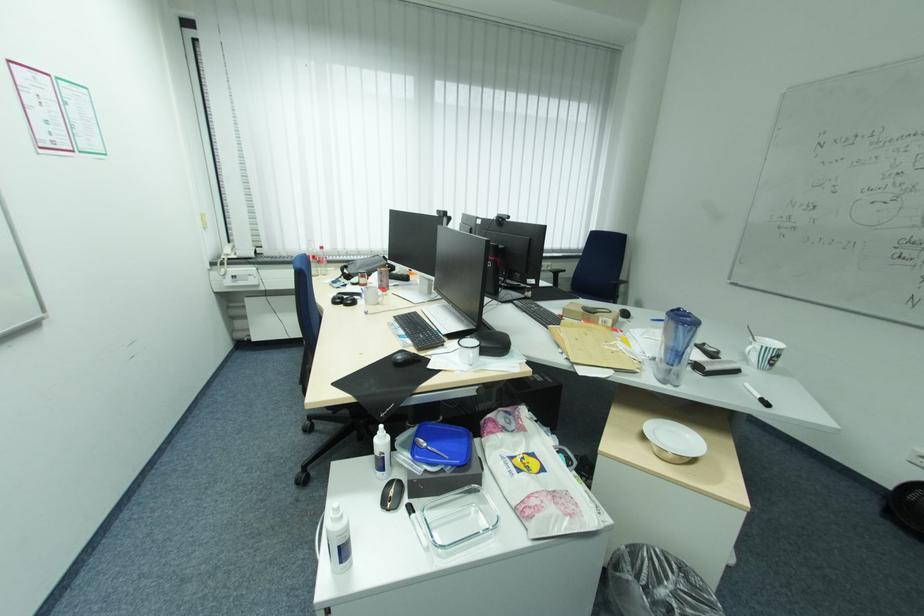
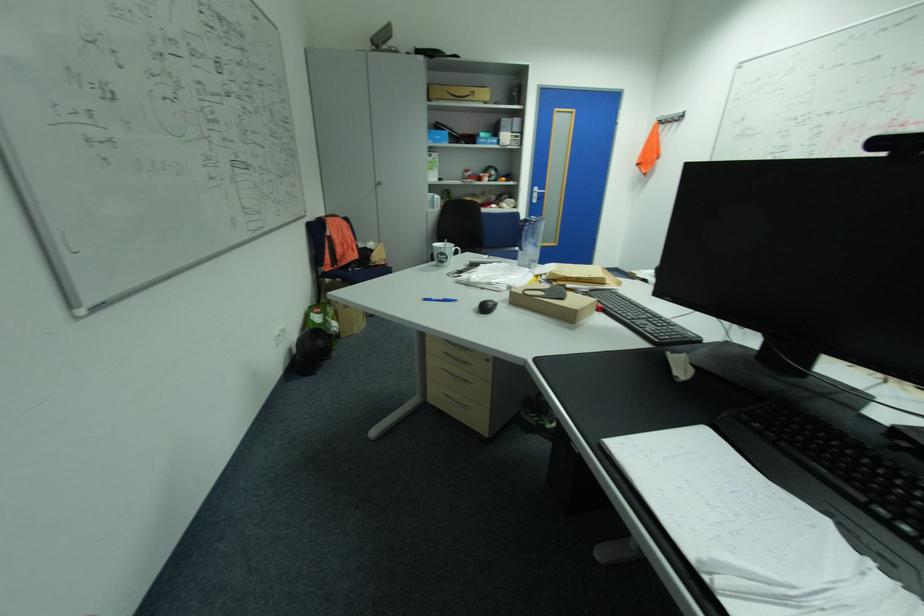
Question: I am providing you with two images of the same scene from different viewpoints. Which of the following objects are not visible in image2?

Choices:
 (A) silver door handle
 (B) metal food container
 (C) white mug handle
 (D) black computer mouse

Answer: (C)